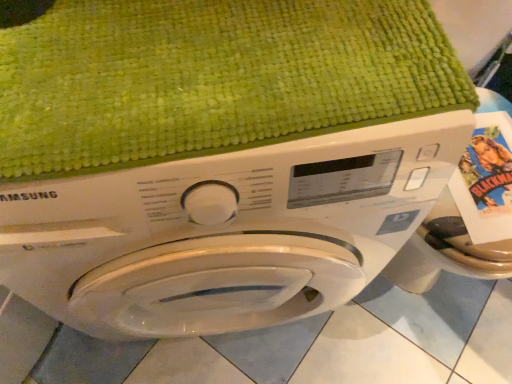
Question: Is white glossy washing machine at center not within green textured bath towel at upper center?

Choices:
 (A) yes
 (B) no

Answer: (A)

Question: From a real-world perspective, is white glossy washing machine at center below green textured bath towel at upper center?

Choices:
 (A) yes
 (B) no

Answer: (A)

Question: Considering the relative sizes of white glossy washing machine at center and green textured bath towel at upper center in the image provided, is white glossy washing machine at center bigger than green textured bath towel at upper center?

Choices:
 (A) no
 (B) yes

Answer: (B)

Question: Is white glossy washing machine at center facing away from green textured bath towel at upper center?

Choices:
 (A) yes
 (B) no

Answer: (B)

Question: Does white glossy washing machine at center turn towards green textured bath towel at upper center?

Choices:
 (A) no
 (B) yes

Answer: (A)

Question: From a real-world perspective, is white glossy washing machine at center physically above green textured bath towel at upper center?

Choices:
 (A) no
 (B) yes

Answer: (A)

Question: Is green textured bath towel at upper center at the right side of white glossy washing machine at center?

Choices:
 (A) yes
 (B) no

Answer: (A)

Question: Is green textured bath towel at upper center not within white glossy washing machine at center?

Choices:
 (A) yes
 (B) no

Answer: (B)

Question: Does green textured bath towel at upper center appear on the left side of white glossy washing machine at center?

Choices:
 (A) yes
 (B) no

Answer: (B)

Question: Are green textured bath towel at upper center and white glossy washing machine at center far apart?

Choices:
 (A) no
 (B) yes

Answer: (A)

Question: Does green textured bath towel at upper center have a lesser width compared to white glossy washing machine at center?

Choices:
 (A) yes
 (B) no

Answer: (A)

Question: From a real-world perspective, is green textured bath towel at upper center physically below white glossy washing machine at center?

Choices:
 (A) yes
 (B) no

Answer: (B)

Question: From the image's perspective, is white glossy washing machine at center above or below green textured bath towel at upper center?

Choices:
 (A) above
 (B) below

Answer: (B)